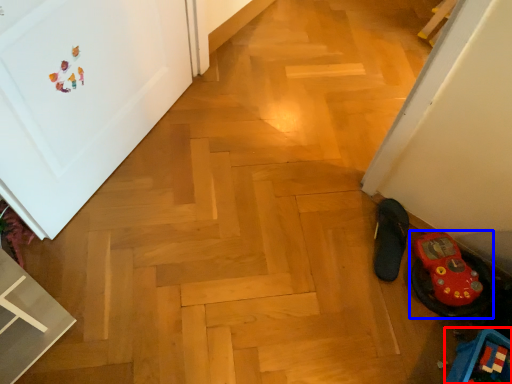
Question: Which object appears closest to the camera in this image, toy (highlighted by a red box) or footwear (highlighted by a blue box)?

Choices:
 (A) toy
 (B) footwear

Answer: (A)